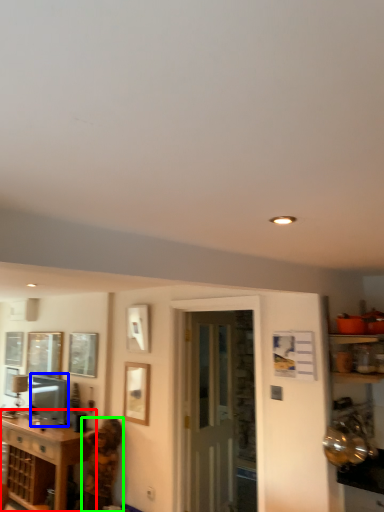
Question: Based on their relative distances, which object is farther from cabinetry (highlighted by a red box)? Choose from appliance (highlighted by a blue box) and person (highlighted by a green box).

Choices:
 (A) appliance
 (B) person

Answer: (A)